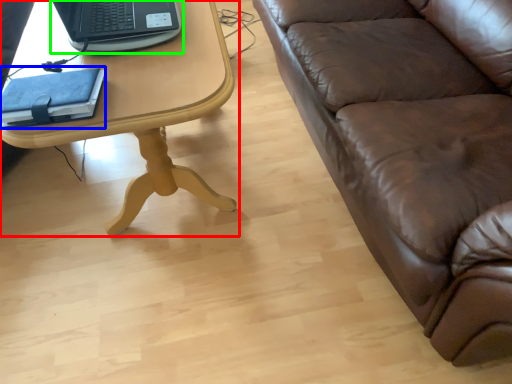
Question: Which object is the farthest from table (highlighted by a red box)? Choose among these: notebook (highlighted by a blue box) or laptop (highlighted by a green box).

Choices:
 (A) notebook
 (B) laptop

Answer: (A)